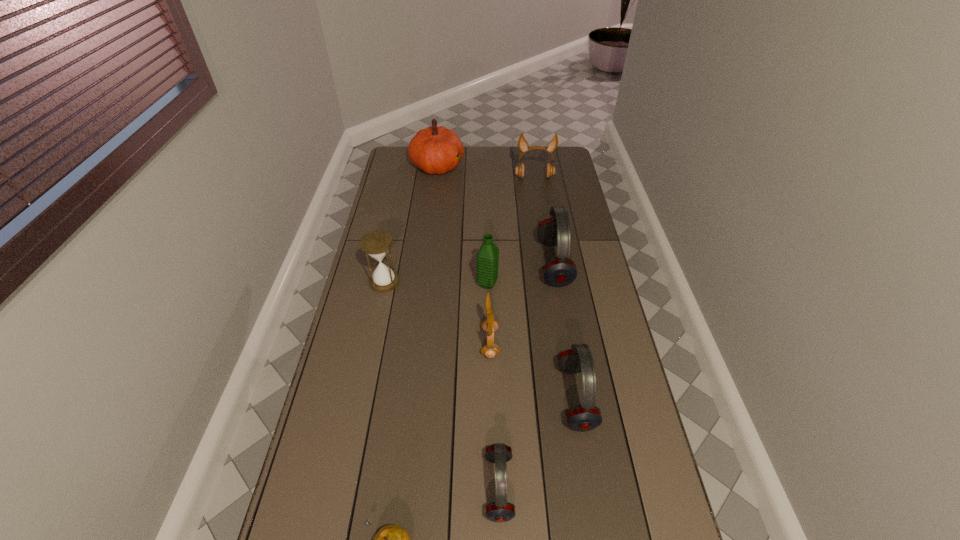
Identify the location of blank area located on the ear cups of the second farthest red earphone. This screenshot has height=540, width=960. pyautogui.click(x=437, y=397).

Where is `vacant space located on the ear cups of the second farthest red earphone`? This screenshot has width=960, height=540. vacant space located on the ear cups of the second farthest red earphone is located at coordinates (461, 397).

This screenshot has width=960, height=540. I want to click on free spot located 0.060m on the ear cups of the second farthest red earphone, so click(540, 397).

Identify the location of vacant space located on the front-facing side of the left brown earphone. (383, 343).

I want to click on vacant area situated 0.110m on the front-facing side of the left brown earphone, so click(x=447, y=343).

The image size is (960, 540). I want to click on vacant area situated 0.070m on the front-facing side of the left brown earphone, so (x=460, y=343).

This screenshot has width=960, height=540. What are the coordinates of `free location located 0.220m on the ear cups of the smallest red earphone` in the screenshot? It's located at (398, 487).

Identify the location of free location located 0.380m on the ear cups of the smallest red earphone. (335, 487).

Find the location of a particular element. blank area located on the ear cups of the smallest red earphone is located at coordinates (442, 487).

You are a GUI agent. You are given a task and a screenshot of the screen. Output one action in this format:
    pyautogui.click(x=<x>, y=<y>)
    Task: Click on the object present at the far edge
    
    Given the screenshot: What is the action you would take?
    pyautogui.click(x=434, y=150)